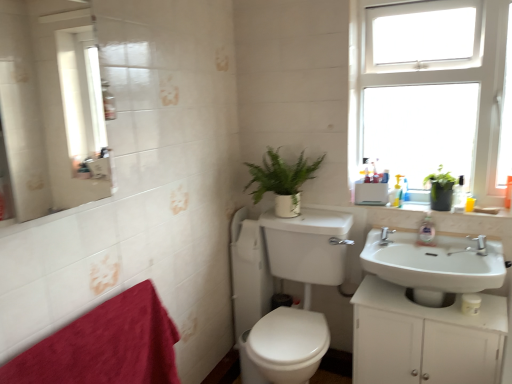
This screenshot has height=384, width=512. I want to click on vacant space in front of translucent plastic soap dispenser at upper right, which ranks as the second toiletry in front-to-back order, so click(409, 205).